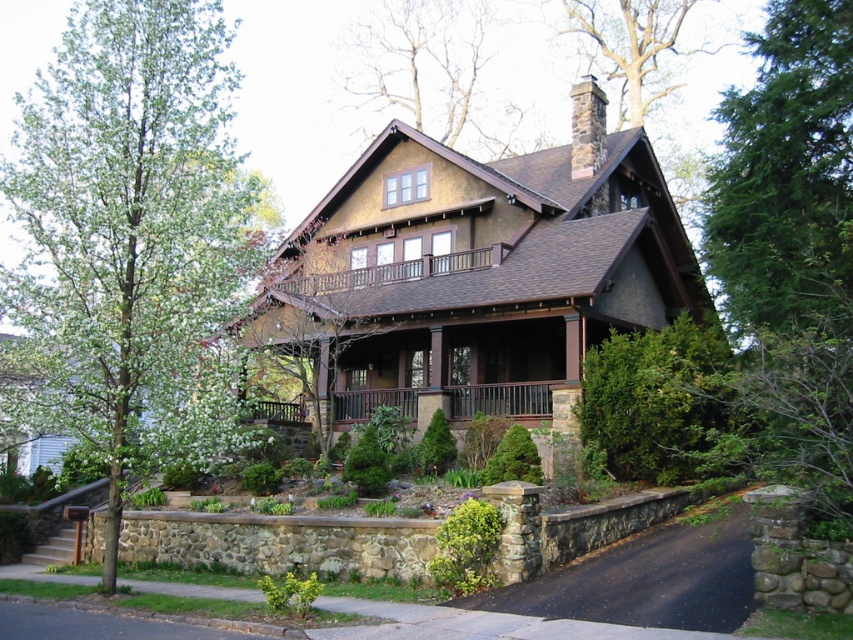
You are a painter who wants to paint the green leafy tree at upper right and the brown wooden porch at center. Since you have limited paint, which object requires more paint to cover its entire visible area?

The brown wooden porch at center requires more paint because it has a greater width than the green leafy tree at upper right.

You are standing at the front of the house and see two points marked on the image. One is at point (189, 10) and the other at point (662, 595). Which point is closer to you?

Point (662, 595) is closer to you because it is in front of point (189, 10).